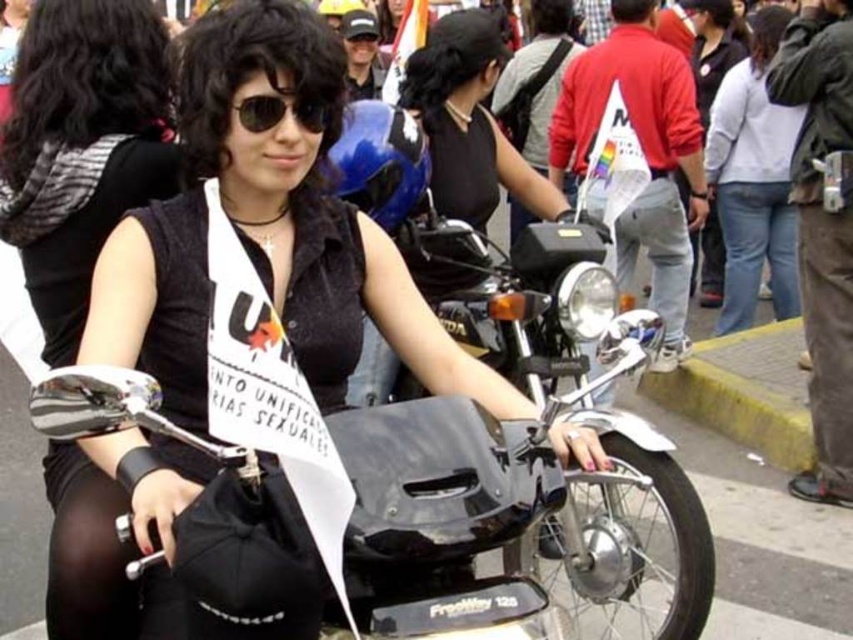
Can you confirm if black matte helmet at upper center is wider than jeans at right?

Yes.

Who is positioned more to the right, black matte helmet at upper center or jeans at right?

jeans at right

Identify the location of black matte helmet at upper center. (469, 122).

Between matte black vest at center and white cotton shirt at upper right, which one has more height?

Standing taller between the two is white cotton shirt at upper right.

The width and height of the screenshot is (853, 640). What do you see at coordinates (310, 205) in the screenshot? I see `matte black vest at center` at bounding box center [310, 205].

Where is `matte black vest at center`? The height and width of the screenshot is (640, 853). matte black vest at center is located at coordinates (310, 205).

The width and height of the screenshot is (853, 640). Describe the element at coordinates (310, 205) in the screenshot. I see `matte black vest at center` at that location.

Is point (358, 285) in front of point (440, 70)?

That is True.

The width and height of the screenshot is (853, 640). I want to click on matte black vest at center, so click(310, 205).

Identify the location of matte black vest at center. (310, 205).